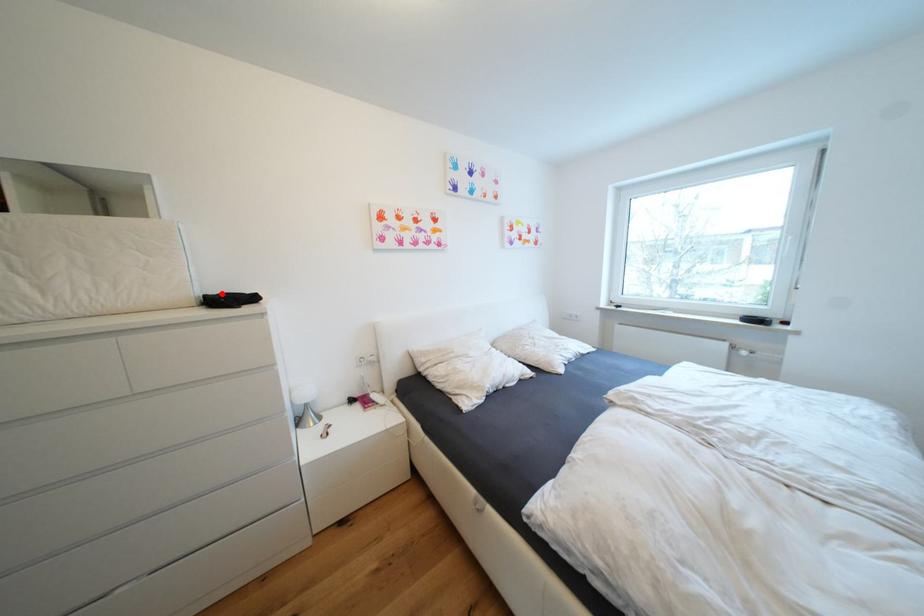
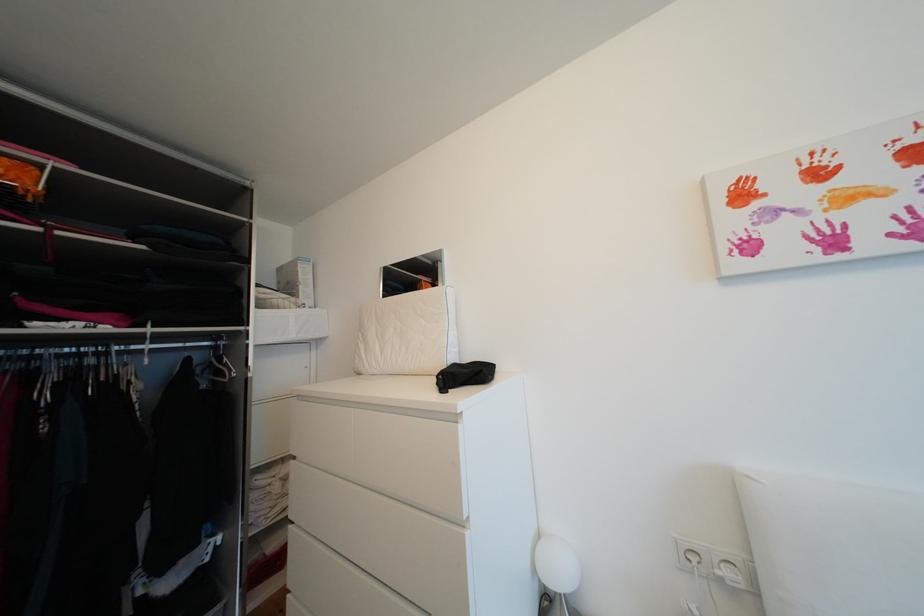
In the second image, find the point that corresponds to the highlighted location in the first image.

(473, 362)